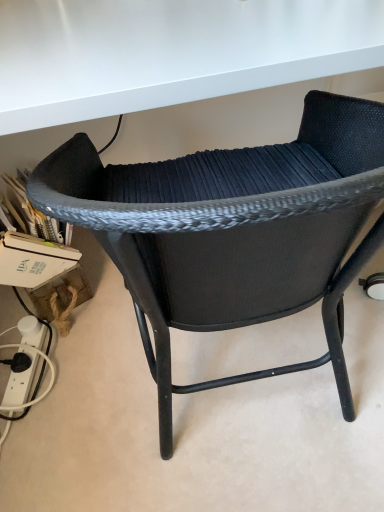
What are the coordinates of `vacant area that lies to the right of black plastic plug at lower left` in the screenshot? It's located at tap(84, 364).